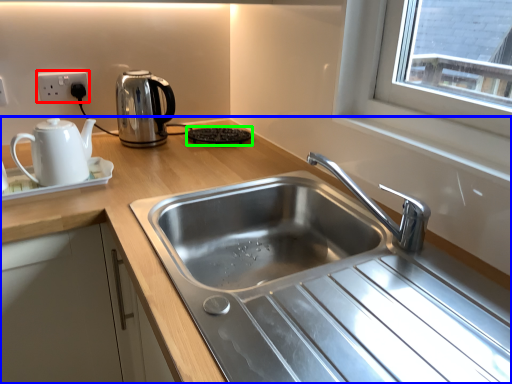
Question: Which is nearer to the electric outlet (highlighted by a red box)? countertop (highlighted by a blue box) or appliance (highlighted by a green box).

Choices:
 (A) countertop
 (B) appliance

Answer: (B)